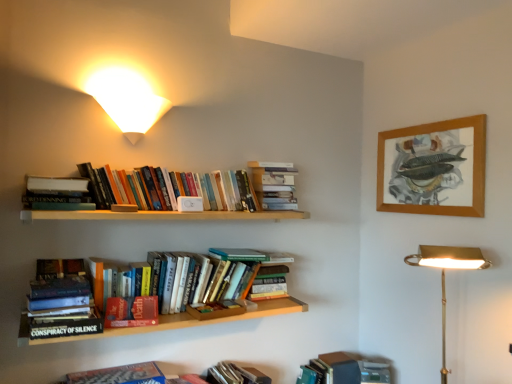
Image resolution: width=512 pixels, height=384 pixels. In order to click on vacant space underneath hardcover books at upper center, which is counted as the 6th book, starting from the bottom (from a real-world perspective) in this screenshot , I will do `click(130, 369)`.